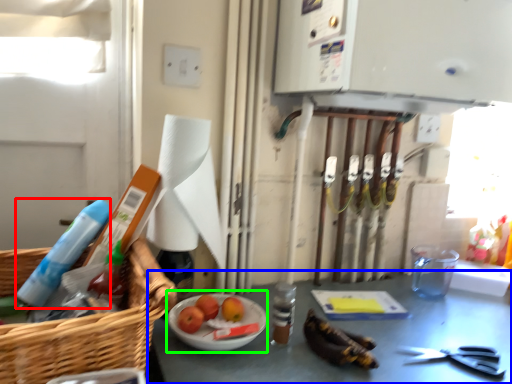
Question: Based on their relative distances, which object is farther from cleaning product (highlighted by a red box)? Choose from table (highlighted by a blue box) and fruit dish (highlighted by a green box).

Choices:
 (A) table
 (B) fruit dish

Answer: (A)